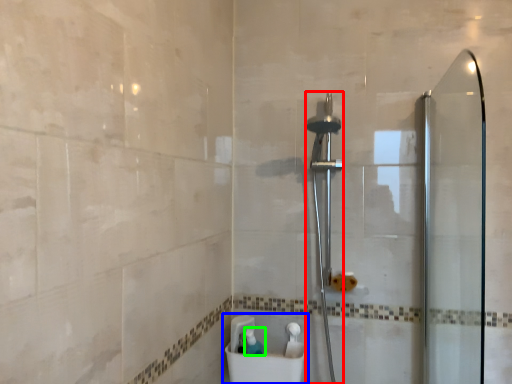
Question: Which object is positioned farthest from shower (highlighted by a red box)? Select from sink (highlighted by a blue box) and toiletry (highlighted by a green box).

Choices:
 (A) sink
 (B) toiletry

Answer: (B)